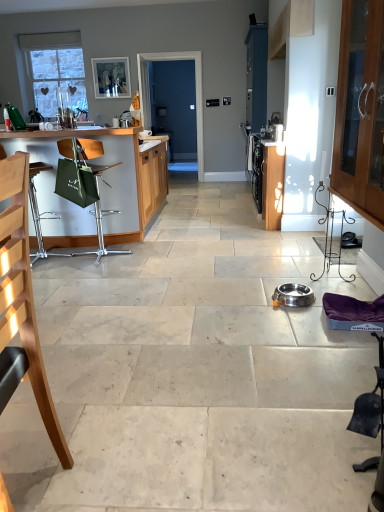
Locate an element on the screen. The image size is (384, 512). vacant point to the left of black fabric swivel chair at lower right is located at coordinates (318, 464).